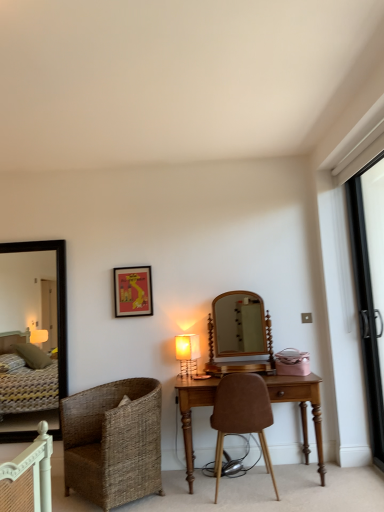
This screenshot has height=512, width=384. Identify the location of blank area beneath brown leather chair at center, arranged as the second chair when viewed from the left (from a real-world perspective). (253, 495).